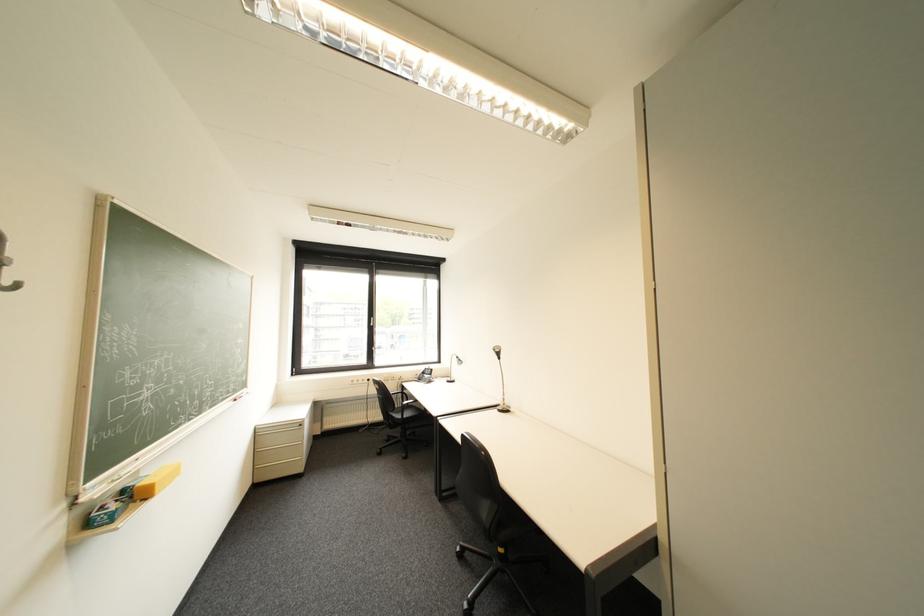
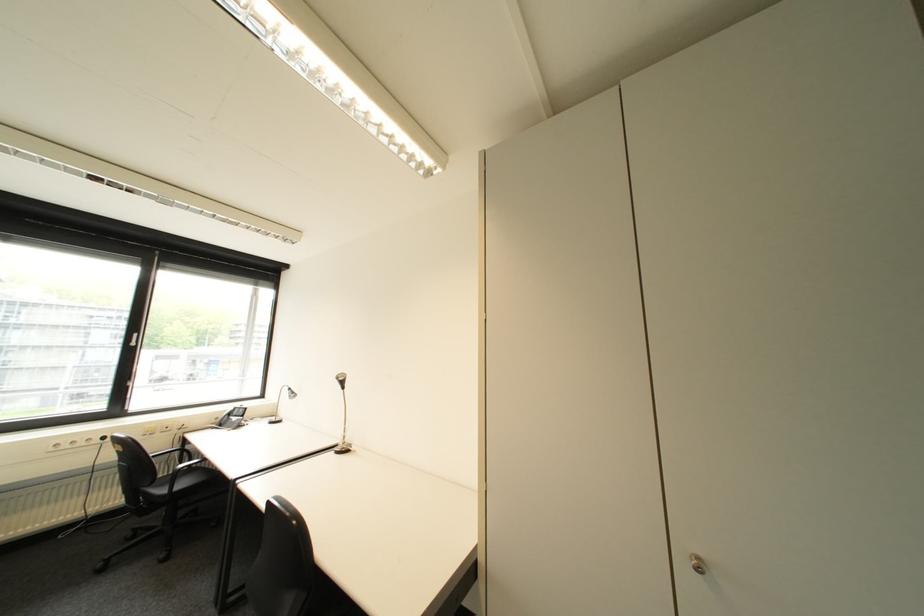
Locate, in the second image, the point that corresponds to (415,416) in the first image.

(187, 488)